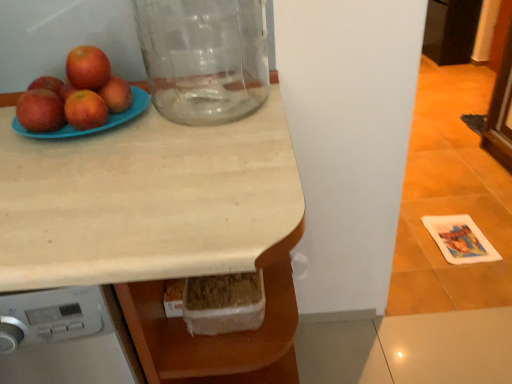
Where is `vacant space situated above light wood countertop at center (from a real-world perspective)`? The height and width of the screenshot is (384, 512). vacant space situated above light wood countertop at center (from a real-world perspective) is located at coordinates (222, 148).